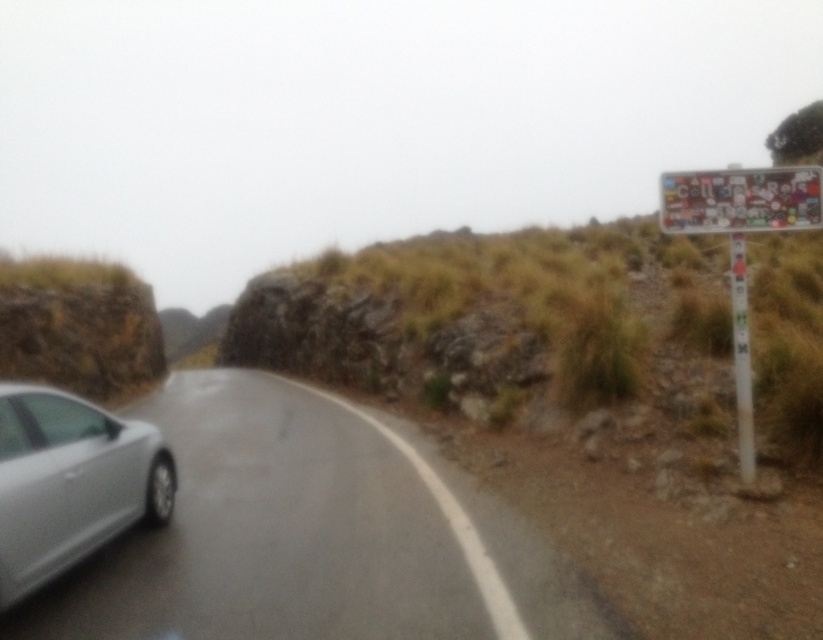
Question: Does multicolored stickers at right appear over multicolored stickers at upper right?

Choices:
 (A) yes
 (B) no

Answer: (B)

Question: Among these objects, which one is farthest from the camera?

Choices:
 (A) multicolored stickers at right
 (B) silver metallic car at left

Answer: (A)

Question: Can you confirm if silver metallic car at left is thinner than multicolored stickers at upper right?

Choices:
 (A) yes
 (B) no

Answer: (B)

Question: Which object is positioned closest to the satin silver car at left?

Choices:
 (A) silver metallic car at left
 (B) multicolored stickers at upper right

Answer: (A)

Question: Which point is farther to the camera?

Choices:
 (A) multicolored stickers at right
 (B) satin silver car at left
 (C) multicolored stickers at upper right

Answer: (A)

Question: Does silver metallic car at left come behind multicolored stickers at right?

Choices:
 (A) yes
 (B) no

Answer: (B)